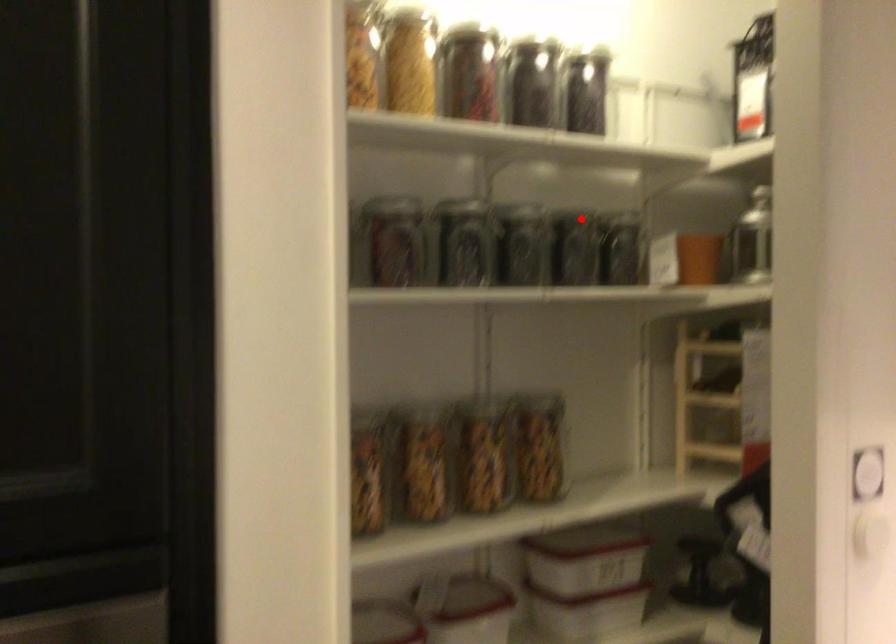
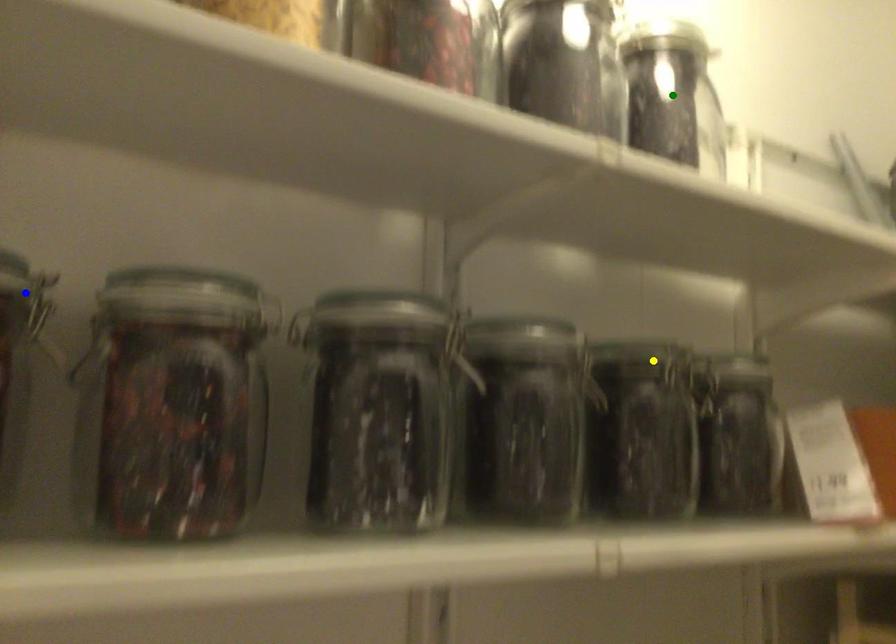
Question: I am providing you with two images of the same scene from different viewpoints. A red point is marked on the first image. You are given multiple points on the second image. Can you choose the point in image 2 that corresponds to the point in image 1?

Choices:
 (A) green point
 (B) yellow point
 (C) blue point

Answer: (B)